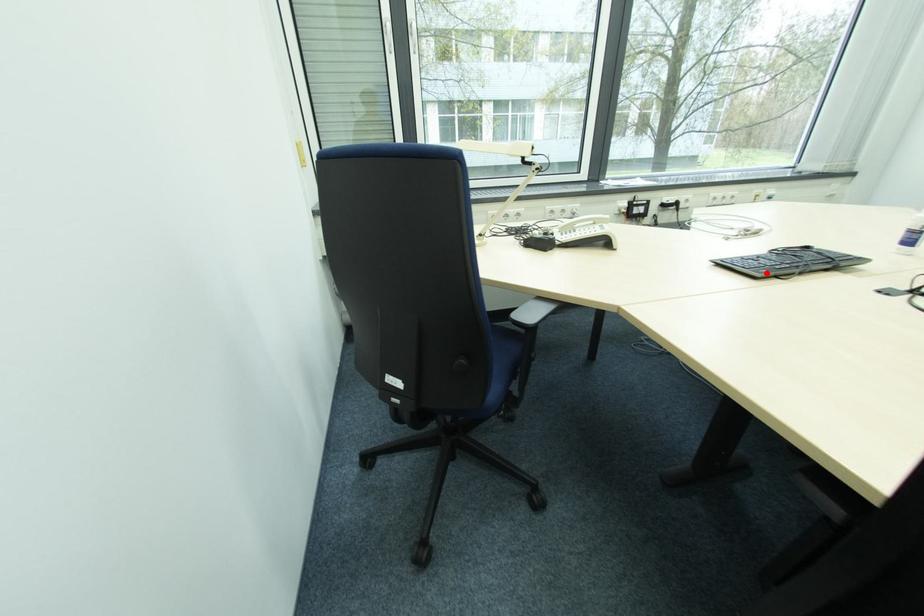
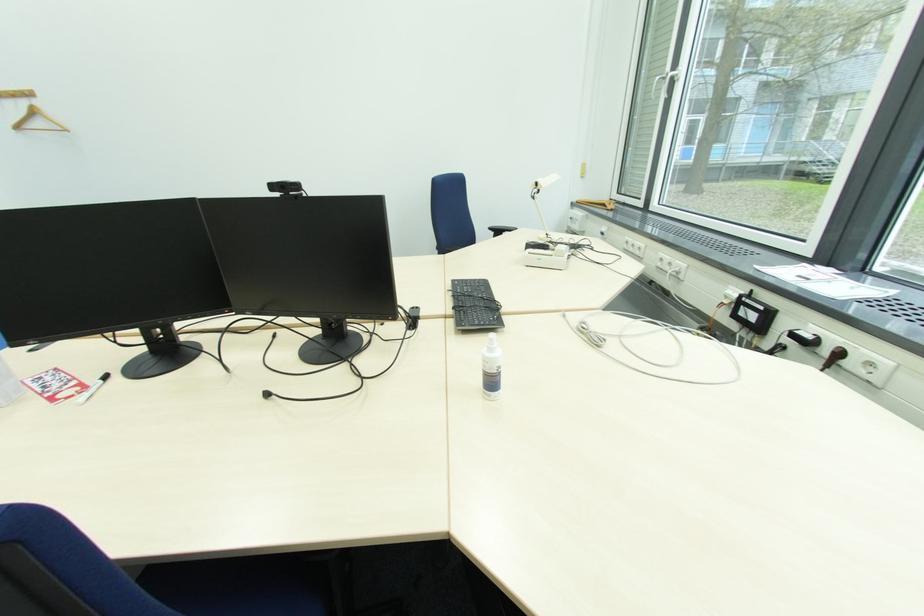
Where in the second image is the point corresponding to the highlighted location from the first image?

(459, 285)